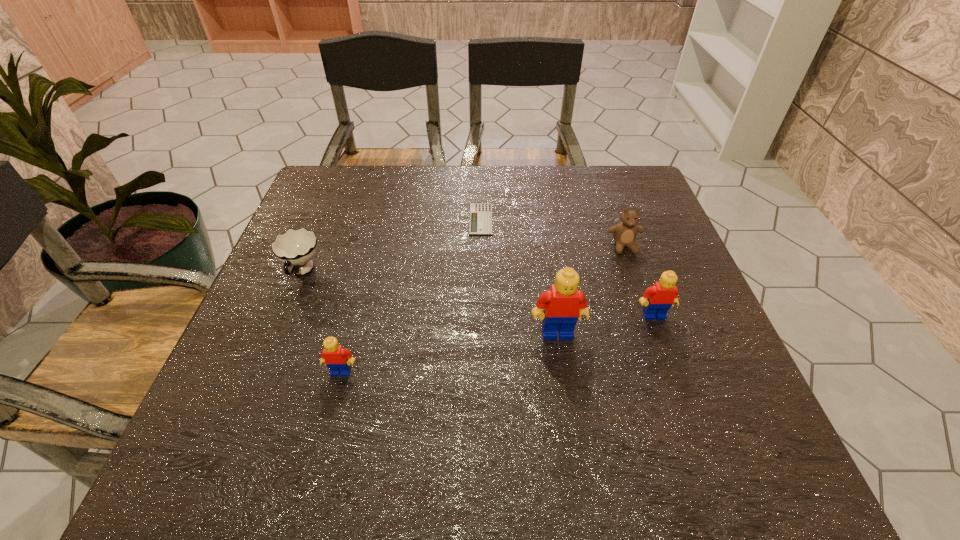
Locate which Lego is the closest to the fifth shortest object. Please provide its 2D coordinates. Your answer should be formatted as a tuple, i.e. [(x, y)], where the tuple contains the x and y coordinates of a point satisfying the conditions above.

[(563, 303)]

Select which Lego is the second closest to the cup. Please provide its 2D coordinates. Your answer should be formatted as a tuple, i.e. [(x, y)], where the tuple contains the x and y coordinates of a point satisfying the conditions above.

[(563, 303)]